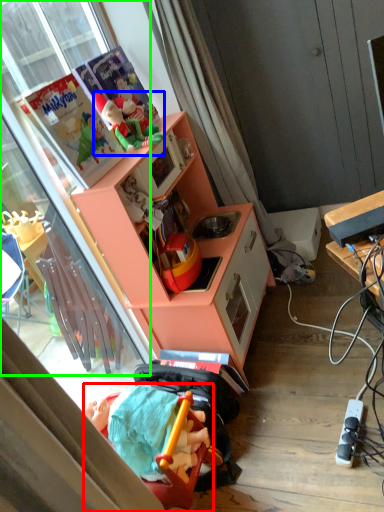
Question: Which object is positioned closest to toy (highlighted by a red box)? Select from toy (highlighted by a blue box) and glass door (highlighted by a green box).

Choices:
 (A) toy
 (B) glass door

Answer: (B)